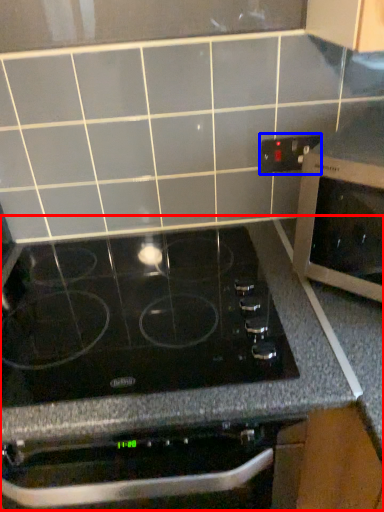
Question: Which object appears closest to the camera in this image, counter (highlighted by a red box) or electric outlet (highlighted by a blue box)?

Choices:
 (A) counter
 (B) electric outlet

Answer: (A)